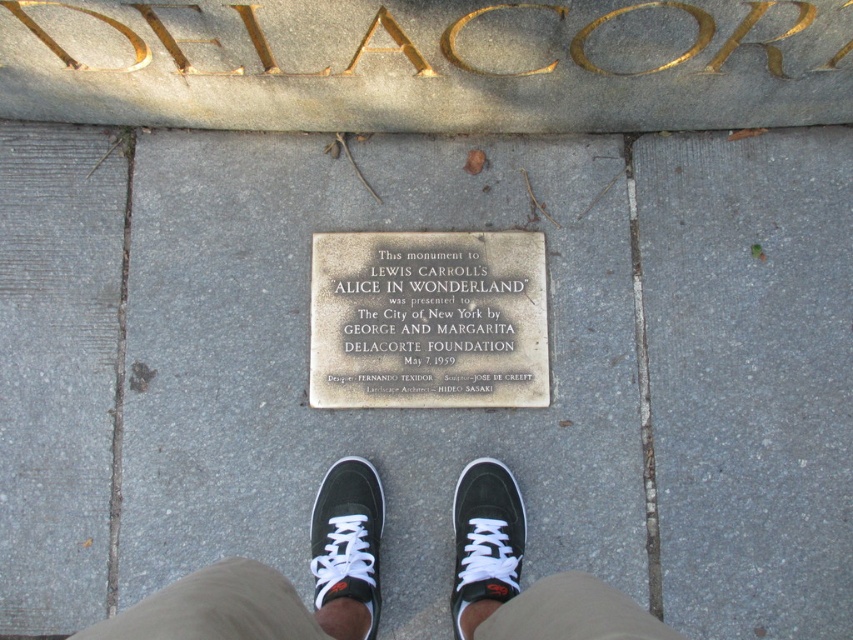
You are a photographer trying to capture the silver metallic plaque at center and the black matte sneaker at lower center in a single frame. The camera you are using has a fixed focal length lens, so you can only adjust your distance from the scene. To ensure both objects are fully visible in the frame, should you move closer or farther away from the scene?

You should move farther away from the scene. Since the silver metallic plaque at center is wider than the black matte sneaker at lower center, moving farther away will allow both objects to fit within the camera frame by reducing their relative sizes.

You are standing in front of the commemorative plaque and wearing black fabric pants at lower center. If you want to take a photo of the plaque without your pants appearing in the frame, how far back should you step?

The black fabric pants at lower center and viewer are 32.05 inches apart from each other. To avoid the pants appearing in the photo, you should step back at least 32.05 inches from the current position.

What are the coordinates of the silver metallic plaque at center?

The silver metallic plaque at center is located at coordinates point [428,320].